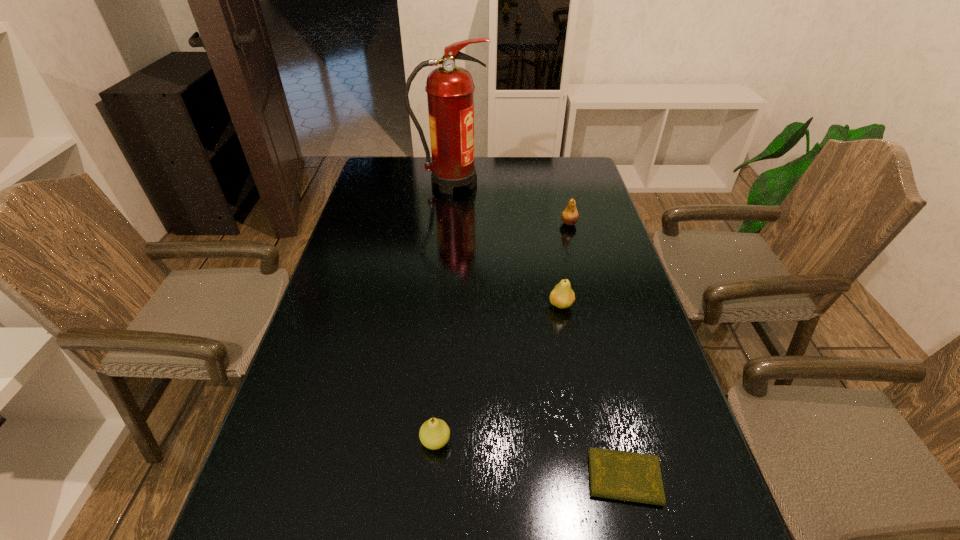
Identify the location of blank area at the far left corner. (385, 163).

Image resolution: width=960 pixels, height=540 pixels. Find the location of `vacant area that lies between the shortest object and the shortest pear`. vacant area that lies between the shortest object and the shortest pear is located at coordinates (530, 460).

Find the location of `free space between the shortest object and the nearest pear`. free space between the shortest object and the nearest pear is located at coordinates (530, 460).

Find the location of a particular element. Image resolution: width=960 pixels, height=540 pixels. vacant space that is in between the third farthest object and the shortest pear is located at coordinates (498, 373).

Image resolution: width=960 pixels, height=540 pixels. Find the location of `unoccupied position between the nearest pear and the fourth nearest object`. unoccupied position between the nearest pear and the fourth nearest object is located at coordinates (502, 332).

The image size is (960, 540). Identify the location of vacant area between the diary and the nearest pear. (530, 460).

Image resolution: width=960 pixels, height=540 pixels. Identify the location of free space between the farthest pear and the fire extinguisher. (510, 203).

You are a GUI agent. You are given a task and a screenshot of the screen. Output one action in this format:
    pyautogui.click(x=<x>, y=<y>)
    Task: Click on the free space between the farthest object and the fourth nearest object
    
    Given the screenshot: What is the action you would take?
    pyautogui.click(x=510, y=203)

You are a GUI agent. You are given a task and a screenshot of the screen. Output one action in this format:
    pyautogui.click(x=<x>, y=<y>)
    Task: Click on the vacant region between the shortest object and the fourth tallest object
    
    Given the screenshot: What is the action you would take?
    pyautogui.click(x=530, y=460)

Locate an element on the screen. empty space that is in between the third nearest object and the shortest object is located at coordinates (592, 392).